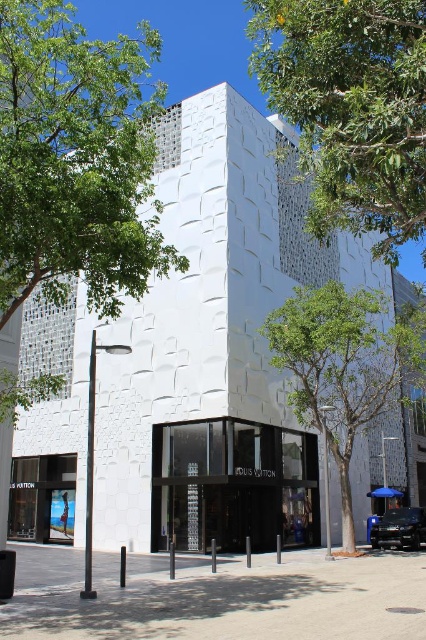
You are standing at the entrance of the LOUIS VUITTON store and want to take a photo that includes both the white textured building at center and the green leafy tree at upper left. Can you fit both into your camera frame if your camera has a 100mm lens and you are 15 feet away from the building?

The white textured building at center is 22.16 feet away from the green leafy tree at upper left. Since you are 15 feet away from the building, the tree is 22.16 minus 15 equals 7.16 feet behind you. A 100mm lens has a field of view that can capture objects within a certain distance range. However, the tree is behind the building from your perspective, so it won not be visible in the frame. Therefore, you cannot fit both into the camera frame.

You are a photographer planning to capture the LOUIS VUITTON entrance while including both the white textured building at center and the green leafy tree at upper left in the frame. Based on their sizes, which object should you focus on to ensure both are visible without cropping?

The white textured building at center is larger in size than the green leafy tree at upper left, so you should focus on the white textured building at center to ensure both are visible without cropping.